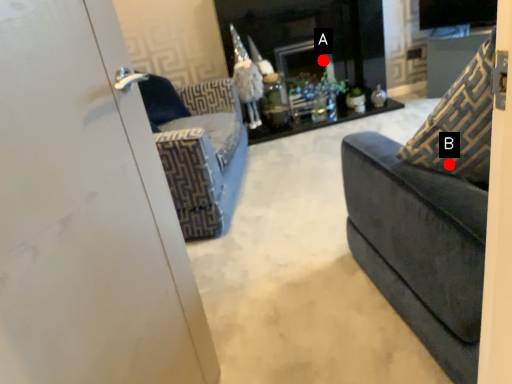
Question: Two points are circled on the image, labeled by A and B beside each circle. Which point is farther from the camera taking this photo?

Choices:
 (A) A is further
 (B) B is further

Answer: (A)